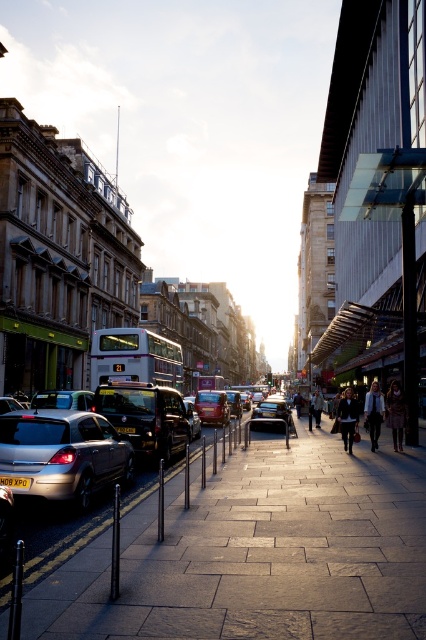
You are a street vendor setting up a clothing stand in the middle of the urban street scene. You have two items to display on the stand, the white textured coat at center and the dark gray sweater at center. Since space is limited, you need to know which item takes up more space. Which one is larger?

The white textured coat at center is bigger than the dark gray sweater at center, so it takes up more space.

You are a delivery person who needs to deliver a package to a person wearing dark gray sweater at center and dark blue jeans at center. The package is too heavy to carry over long distances. Can you reach the person without walking more than 20 meters?

The dark gray sweater at center and dark blue jeans at center are 22.97 meters apart, so you cannot reach the person without walking more than 20 meters.

You are a delivery person carrying a package that requires a 2 meter clearance to pass through a narrow alleyway between the white textured coat at center and the dark gray sweater at center. Can you safely navigate through the space between them?

The distance between the white textured coat at center and the dark gray sweater at center is 2.28 meters, which is wider than the required 2 meter clearance. Therefore, you can safely navigate through the space between them.